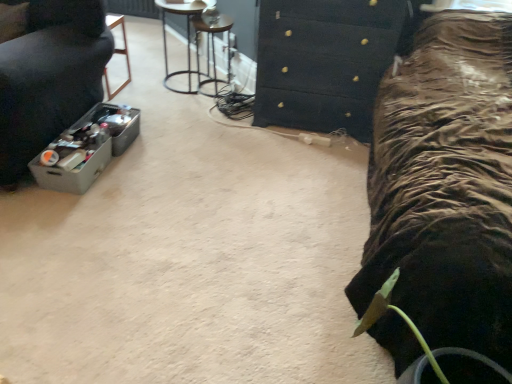
Question: Is metallic wireframe stool at upper center positioned before black textured chest of drawers at upper center?

Choices:
 (A) no
 (B) yes

Answer: (A)

Question: Is metallic wireframe stool at upper center smaller than black textured chest of drawers at upper center?

Choices:
 (A) no
 (B) yes

Answer: (B)

Question: Is metallic wireframe stool at upper center oriented away from black textured chest of drawers at upper center?

Choices:
 (A) yes
 (B) no

Answer: (B)

Question: From a real-world perspective, is metallic wireframe stool at upper center on black textured chest of drawers at upper center?

Choices:
 (A) no
 (B) yes

Answer: (A)

Question: Is metallic wireframe stool at upper center to the left of black textured chest of drawers at upper center from the viewer's perspective?

Choices:
 (A) yes
 (B) no

Answer: (A)

Question: Is metallic wireframe stool at upper center thinner than black textured chest of drawers at upper center?

Choices:
 (A) no
 (B) yes

Answer: (B)

Question: From a real-world perspective, does metallic wireframe stool at upper center sit lower than metallic wire side table at upper center, which ranks as the second furniture in front-to-back order?

Choices:
 (A) yes
 (B) no

Answer: (A)

Question: Does metallic wireframe stool at upper center come behind metallic wire side table at upper center, arranged as the 2th furniture when viewed from the left?

Choices:
 (A) yes
 (B) no

Answer: (A)

Question: Is the surface of metallic wireframe stool at upper center in direct contact with metallic wire side table at upper center, acting as the 1th furniture starting from the back?

Choices:
 (A) no
 (B) yes

Answer: (A)

Question: Does metallic wireframe stool at upper center have a lesser width compared to metallic wire side table at upper center, which ranks as the second furniture in front-to-back order?

Choices:
 (A) yes
 (B) no

Answer: (B)

Question: From the image's perspective, is metallic wireframe stool at upper center located above metallic wire side table at upper center, arranged as the 2th furniture when viewed from the left?

Choices:
 (A) yes
 (B) no

Answer: (B)

Question: Does metallic wireframe stool at upper center turn towards metallic wire side table at upper center, the 1th furniture from the right?

Choices:
 (A) yes
 (B) no

Answer: (B)

Question: Is metallic wireframe stool at upper center far from gray plastic container at left, the second furniture from the back?

Choices:
 (A) no
 (B) yes

Answer: (B)